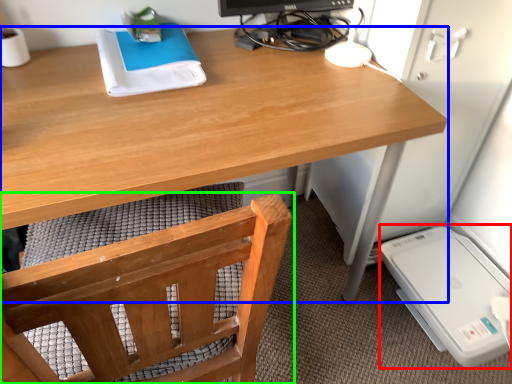
Question: Which is farther away from appliance (highlighted by a red box)? desk (highlighted by a blue box) or chair (highlighted by a green box)?

Choices:
 (A) desk
 (B) chair

Answer: (B)